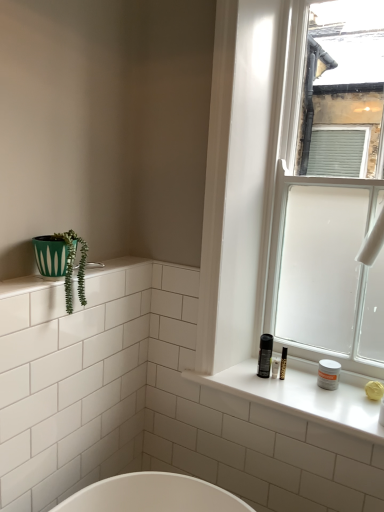
Question: Can you confirm if white glossy window sill at right is bigger than white matte jar at window, which is the 1th toiletry in right-to-left order?

Choices:
 (A) no
 (B) yes

Answer: (B)

Question: Does white glossy window sill at right touch white matte jar at window, which is the 1th toiletry in right-to-left order?

Choices:
 (A) no
 (B) yes

Answer: (A)

Question: From a real-world perspective, is white glossy window sill at right positioned under white matte jar at window, which is counted as the 2th toiletry, starting from the left, based on gravity?

Choices:
 (A) no
 (B) yes

Answer: (B)

Question: Considering the relative positions of white glossy window sill at right and white matte jar at window, which is the 1th toiletry in right-to-left order, in the image provided, is white glossy window sill at right in front of white matte jar at window, which is the 1th toiletry in right-to-left order,?

Choices:
 (A) no
 (B) yes

Answer: (B)

Question: From a real-world perspective, does white glossy window sill at right stand above white matte jar at window, which is the 1th toiletry in right-to-left order?

Choices:
 (A) yes
 (B) no

Answer: (B)

Question: Looking at their shapes, would you say green matte pot at left is wider or thinner than white matte jar at window, which is the 1th toiletry in right-to-left order?

Choices:
 (A) wide
 (B) thin

Answer: (A)

Question: Considering their positions, is green matte pot at left located in front of or behind white matte jar at window, which is the 1th toiletry in right-to-left order?

Choices:
 (A) front
 (B) behind

Answer: (A)

Question: Looking at the image, does green matte pot at left seem bigger or smaller compared to white matte jar at window, which is counted as the 2th toiletry, starting from the left?

Choices:
 (A) big
 (B) small

Answer: (A)

Question: Is point click(x=67, y=236) closer or farther from the camera than point click(x=334, y=388)?

Choices:
 (A) farther
 (B) closer

Answer: (B)

Question: From their relative heights in the image, would you say white glass window at right is taller or shorter than white matte jar at window, which is the 1th toiletry in right-to-left order?

Choices:
 (A) tall
 (B) short

Answer: (A)

Question: Relative to white matte jar at window, which is counted as the 2th toiletry, starting from the left, is white glass window at right in front or behind?

Choices:
 (A) behind
 (B) front

Answer: (B)

Question: Is white glass window at right bigger or smaller than white matte jar at window, which is counted as the 2th toiletry, starting from the left?

Choices:
 (A) small
 (B) big

Answer: (B)

Question: Is white glass window at right to the left or to the right of white matte jar at window, which is the 1th toiletry in right-to-left order, in the image?

Choices:
 (A) right
 (B) left

Answer: (A)

Question: From a real-world perspective, is white matte jar at window, which is counted as the 2th toiletry, starting from the left, above or below green matte pot at left?

Choices:
 (A) above
 (B) below

Answer: (B)

Question: Would you say white matte jar at window, which is counted as the 2th toiletry, starting from the left, is to the left or to the right of green matte pot at left in the picture?

Choices:
 (A) left
 (B) right

Answer: (B)